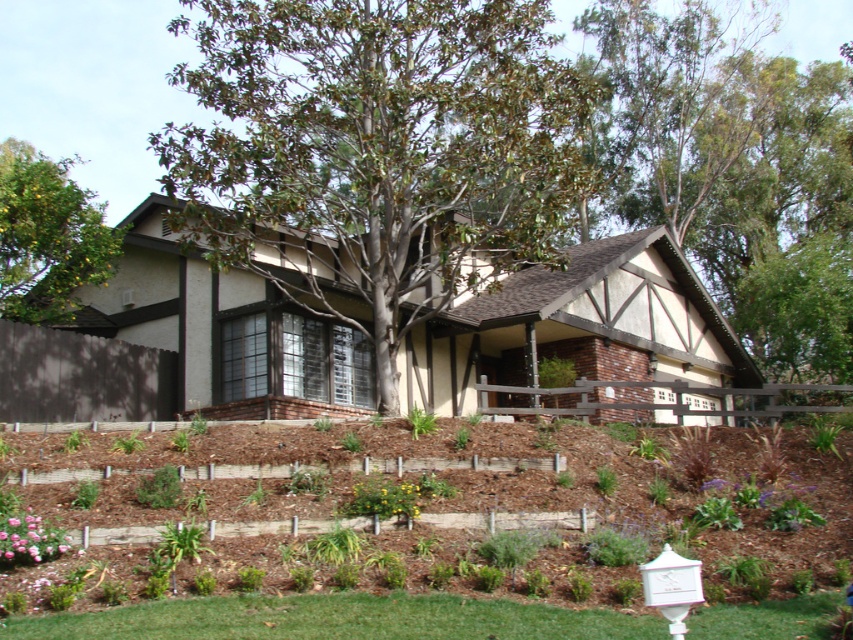
In the scene shown: Can you confirm if green leafy tree at upper left is wider than yellow matte flower at lower center?

Indeed, green leafy tree at upper left has a greater width compared to yellow matte flower at lower center.

Is green leafy tree at upper left thinner than yellow matte flower at lower center?

Incorrect, green leafy tree at upper left's width is not less than yellow matte flower at lower center's.

Which is behind, point (9, 176) or point (398, 508)?

Point (9, 176)

The height and width of the screenshot is (640, 853). I want to click on green leafy tree at upper left, so click(47, 236).

Can you confirm if green leafy tree at upper center is positioned to the right of pink matte flower at lower left?

Correct, you'll find green leafy tree at upper center to the right of pink matte flower at lower left.

Is point (618, 138) in front of point (62, 548)?

No.

Where is `green leafy tree at upper center`? The height and width of the screenshot is (640, 853). green leafy tree at upper center is located at coordinates (737, 170).

Is point (589, 86) positioned in front of point (605, 29)?

Yes, point (589, 86) is closer to viewer.

Where is `green leafy tree at center`? The image size is (853, 640). green leafy tree at center is located at coordinates (376, 152).

Who is more forward, (311, 250) or (828, 317)?

Point (311, 250) is in front.

You are a GUI agent. You are given a task and a screenshot of the screen. Output one action in this format:
    pyautogui.click(x=<x>, y=<y>)
    Task: Click on the green leafy tree at center
    The image size is (853, 640).
    Given the screenshot: What is the action you would take?
    pyautogui.click(x=376, y=152)